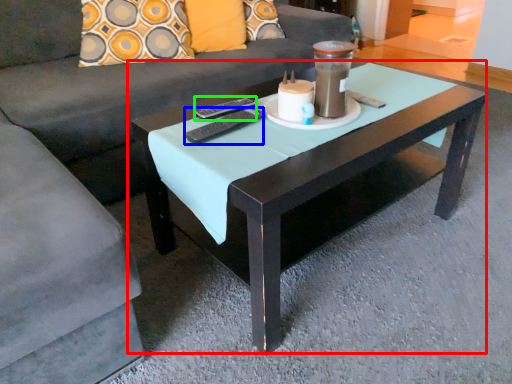
Question: Which is farther away from coffee table (highlighted by a red box)? remote (highlighted by a blue box) or remote (highlighted by a green box)?

Choices:
 (A) remote
 (B) remote

Answer: (B)